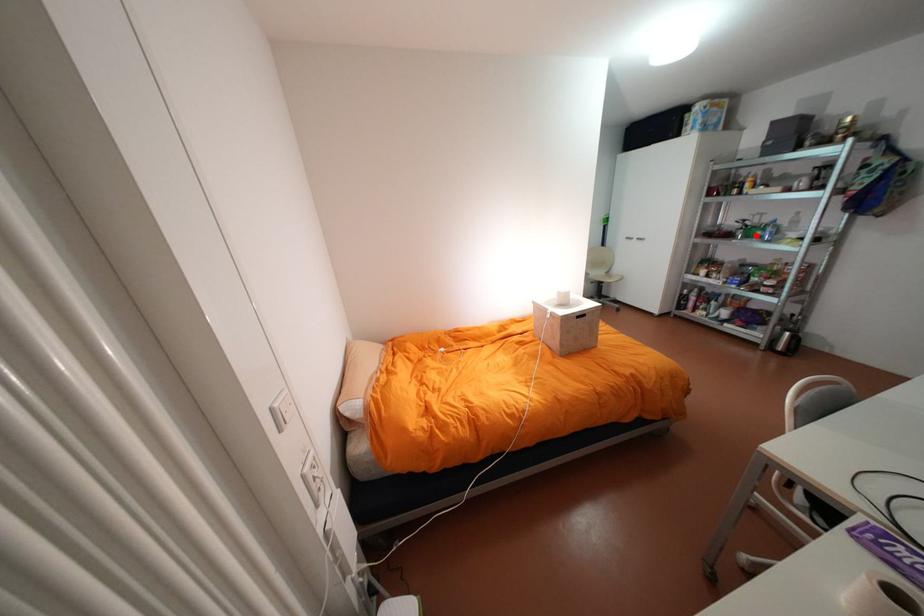
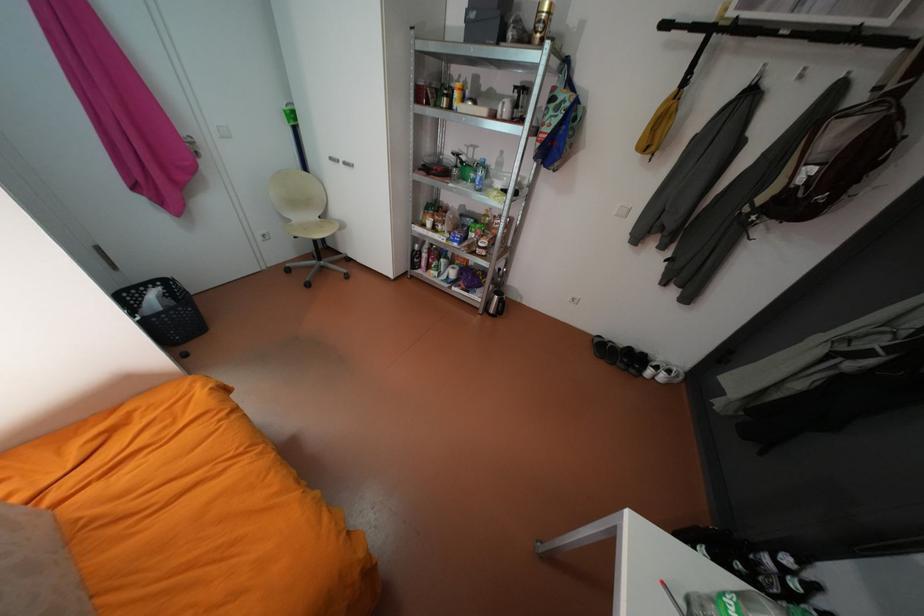
Question: I am providing you with two images of the same scene from different viewpoints. Given a red point in image1, look at the same physical point in image2. Is it:

Choices:
 (A) Closer to the viewpoint
 (B) Farther from the viewpoint

Answer: (A)